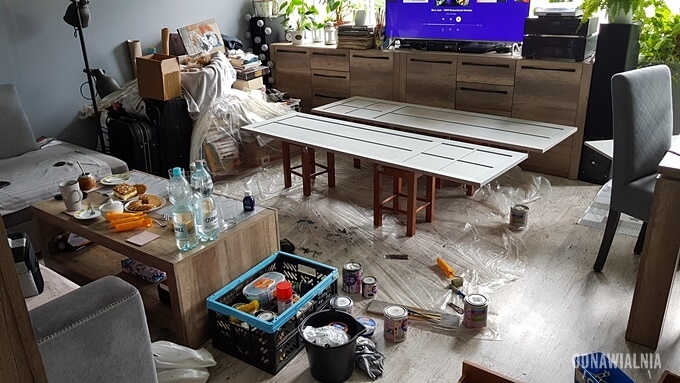
The image size is (680, 383). Identify the location of paint rollers. [129, 225], [122, 218], [112, 216], [250, 307], [454, 280].